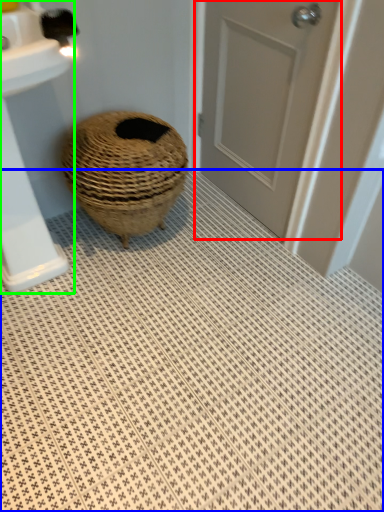
Question: Based on their relative distances, which object is farther from door (highlighted by a red box)? Choose from bath mat (highlighted by a blue box) and sink (highlighted by a green box).

Choices:
 (A) bath mat
 (B) sink

Answer: (B)